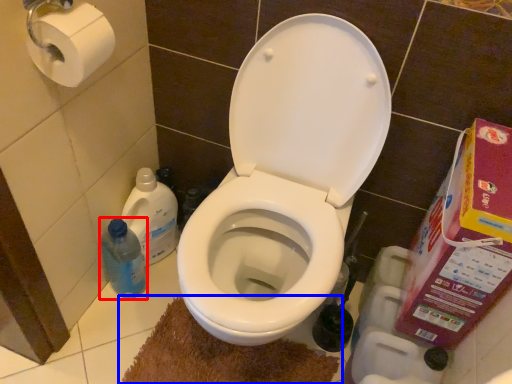
Question: Among these objects, which one is nearest to the camera, cleaning product (highlighted by a red box) or bath mat (highlighted by a blue box)?

Choices:
 (A) cleaning product
 (B) bath mat

Answer: (B)